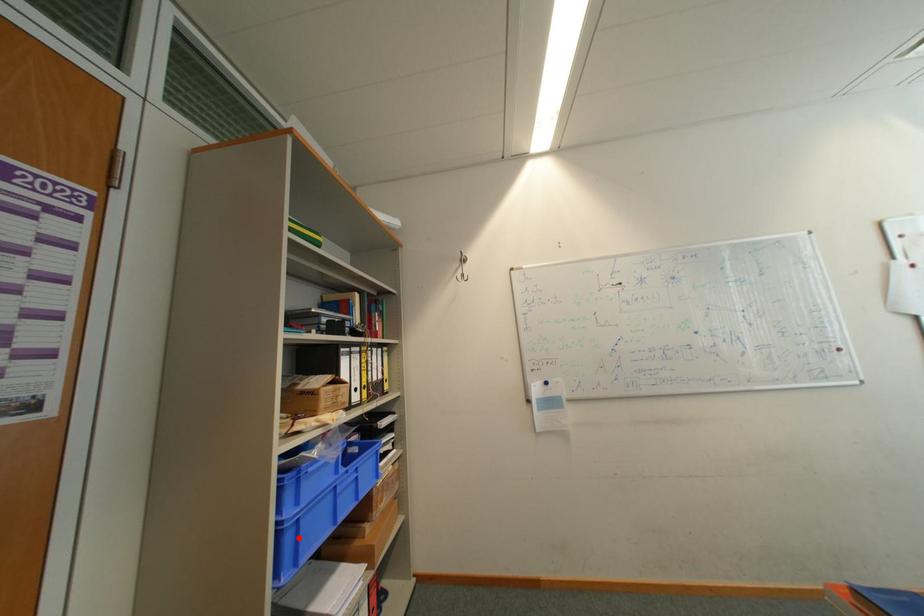
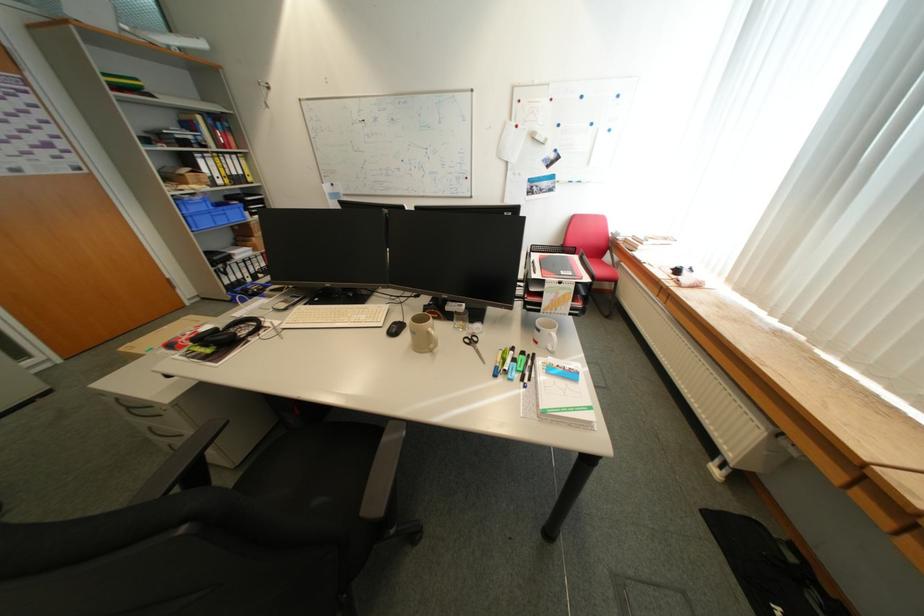
In the second image, find the point that corresponds to the highlighted location in the first image.

(199, 220)